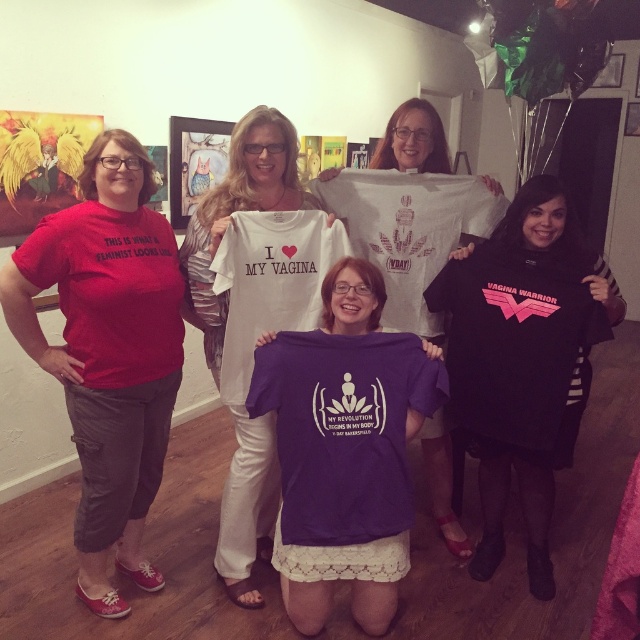
Question: Which of the following is the closest to the observer?

Choices:
 (A) (147, 406)
 (B) (259, 113)

Answer: (A)

Question: Which point is closer to the camera?

Choices:
 (A) (148, 220)
 (B) (410, 156)
 (C) (253, 547)

Answer: (A)

Question: Can you confirm if matte red t-shirt at left is positioned to the right of white cotton shirt at center?

Choices:
 (A) no
 (B) yes

Answer: (A)

Question: Among these objects, which one is farthest from the camera?

Choices:
 (A) matte red t-shirt at left
 (B) white cotton shirt at center

Answer: (B)

Question: Can you confirm if matte red t-shirt at left is smaller than purple fabric t-shirt at center?

Choices:
 (A) no
 (B) yes

Answer: (A)

Question: Can you confirm if white cotton shirt at center is positioned to the left of purple fabric t-shirt at center?

Choices:
 (A) yes
 (B) no

Answer: (A)